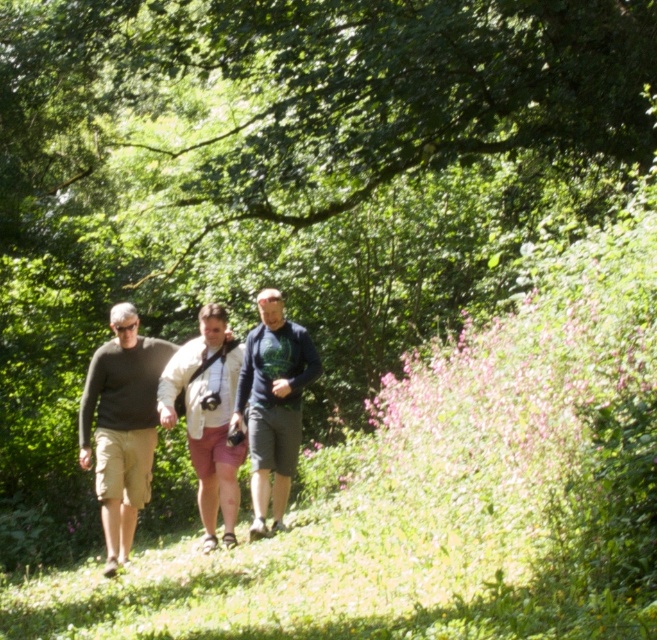
You are a photographer positioned behind the group of three people walking in the forest. You want to take a photo that clearly shows both the dark gray sweater at center and the light beige cotton shorts at center. Based on their positions, which object should you focus on first to ensure both are in sharp focus?

The dark gray sweater at center is in front of the light beige cotton shorts at center. To ensure both are in sharp focus, you should focus on the dark gray sweater at center first, as it is closer to the camera.

You are standing at the dark gray cotton shirt at center. You want to throw a small pebble to a friend who is standing 10 meters away from you. Can you reach your friend with the pebble?

The dark gray cotton shirt at center and viewer are 9.74 meters apart. Since the friend is 10 meters away, you can just barely reach them with the pebble.

You are planning to place a small bench between the dark gray sweater at center and the light beige cotton shorts at center. Given that the bench requires 22 inches of space, will there be enough room?

The dark gray sweater at center is 20.87 inches away from the light beige cotton shorts at center, so the bench requiring 22 inches will not fit in the available space.